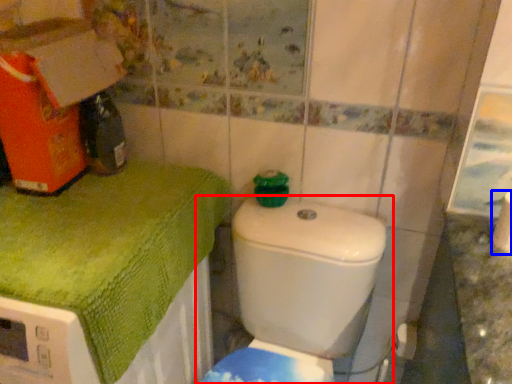
Question: Which object is closer to the camera taking this photo, toilet (highlighted by a red box) or toilet paper (highlighted by a blue box)?

Choices:
 (A) toilet
 (B) toilet paper

Answer: (A)